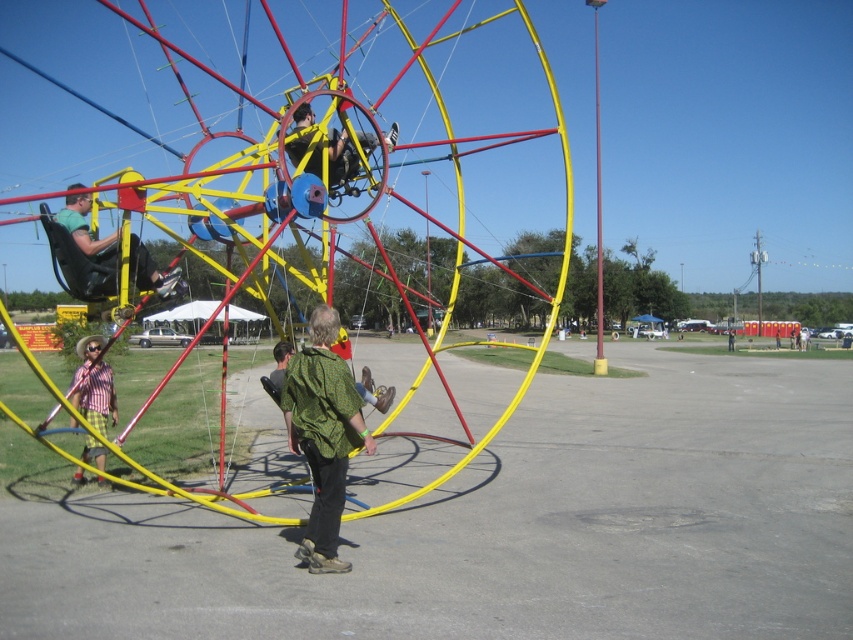
Question: Does green textured shirt at center lie in front of plaid shirt at left?

Choices:
 (A) no
 (B) yes

Answer: (B)

Question: Can you confirm if matte black seat at left is positioned above matte black helmet at upper center?

Choices:
 (A) no
 (B) yes

Answer: (A)

Question: Among these points, which one is nearest to the camera?

Choices:
 (A) 140,278
 (B) 367,138
 (C) 350,390
 (D) 83,364

Answer: (C)

Question: Which point is closer to the camera taking this photo?

Choices:
 (A) (99, 250)
 (B) (96, 365)
 (C) (334, 145)

Answer: (A)

Question: Is green textured shirt at center bigger than matte black helmet at upper center?

Choices:
 (A) no
 (B) yes

Answer: (A)

Question: Which point appears closest to the camera in this image?

Choices:
 (A) (107, 365)
 (B) (175, 269)

Answer: (B)